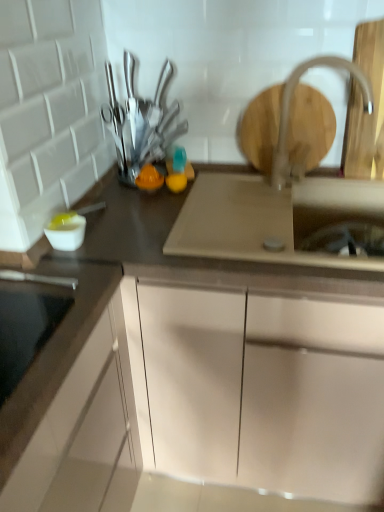
Question: Can you confirm if metallic silver knives at upper center is bigger than white matte cabinet at center?

Choices:
 (A) yes
 (B) no

Answer: (B)

Question: Can you confirm if metallic silver knives at upper center is shorter than white matte cabinet at center?

Choices:
 (A) yes
 (B) no

Answer: (A)

Question: Is metallic silver knives at upper center taller than white matte cabinet at center?

Choices:
 (A) yes
 (B) no

Answer: (B)

Question: Does metallic silver knives at upper center have a greater width compared to white matte cabinet at center?

Choices:
 (A) yes
 (B) no

Answer: (B)

Question: Could you tell me if metallic silver knives at upper center is turned towards white matte cabinet at center?

Choices:
 (A) yes
 (B) no

Answer: (B)

Question: Based on their sizes in the image, would you say satin nickel faucet at upper right is bigger or smaller than white matte cabinet at center?

Choices:
 (A) big
 (B) small

Answer: (B)

Question: Is satin nickel faucet at upper right taller or shorter than white matte cabinet at center?

Choices:
 (A) tall
 (B) short

Answer: (B)

Question: In the image, is satin nickel faucet at upper right on the left side or the right side of white matte cabinet at center?

Choices:
 (A) left
 (B) right

Answer: (B)

Question: From a real-world perspective, is satin nickel faucet at upper right above or below white matte cabinet at center?

Choices:
 (A) below
 (B) above

Answer: (B)

Question: From the image's perspective, is satin nickel faucet at upper right positioned above or below satin silver sink at center?

Choices:
 (A) above
 (B) below

Answer: (A)

Question: Is satin nickel faucet at upper right inside the boundaries of satin silver sink at center, or outside?

Choices:
 (A) inside
 (B) outside

Answer: (B)

Question: Is satin nickel faucet at upper right wider or thinner than satin silver sink at center?

Choices:
 (A) thin
 (B) wide

Answer: (A)

Question: Is satin nickel faucet at upper right in front of or behind satin silver sink at center in the image?

Choices:
 (A) behind
 (B) front

Answer: (A)

Question: From a real-world perspective, is metallic silver knives at upper center positioned above or below satin silver sink at center?

Choices:
 (A) below
 (B) above

Answer: (B)

Question: In terms of size, does metallic silver knives at upper center appear bigger or smaller than satin silver sink at center?

Choices:
 (A) big
 (B) small

Answer: (B)